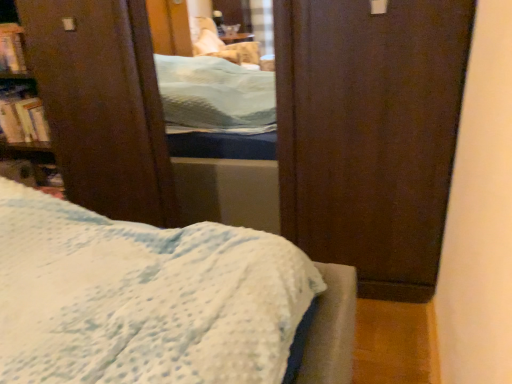
Question: Considering the relative positions of hardcover book at upper left, positioned as the second book in bottom-to-top order, and hardcover book at left, marked as the 1th book in a bottom-to-top arrangement, in the image provided, is hardcover book at upper left, positioned as the second book in bottom-to-top order, to the right of hardcover book at left, marked as the 1th book in a bottom-to-top arrangement, from the viewer's perspective?

Choices:
 (A) yes
 (B) no

Answer: (B)

Question: Is hardcover book at upper left, positioned as the second book in bottom-to-top order, to the left of hardcover book at left, marked as the 1th book in a bottom-to-top arrangement, from the viewer's perspective?

Choices:
 (A) yes
 (B) no

Answer: (A)

Question: Is hardcover book at upper left, placed as the 1th book when sorted from top to bottom, taller than hardcover book at left, which is the 2th book from top to bottom?

Choices:
 (A) no
 (B) yes

Answer: (B)

Question: Is hardcover book at upper left, placed as the 1th book when sorted from top to bottom, wider than hardcover book at left, which is the 2th book from top to bottom?

Choices:
 (A) no
 (B) yes

Answer: (A)

Question: Does hardcover book at upper left, placed as the 1th book when sorted from top to bottom, have a lesser height compared to hardcover book at left, marked as the 1th book in a bottom-to-top arrangement?

Choices:
 (A) no
 (B) yes

Answer: (A)

Question: Is hardcover book at upper left, placed as the 1th book when sorted from top to bottom, facing away from hardcover book at left, which is the 2th book from top to bottom?

Choices:
 (A) yes
 (B) no

Answer: (B)

Question: Is hardcover book at left, marked as the 1th book in a bottom-to-top arrangement, to the left of hardcover book at upper left, positioned as the second book in bottom-to-top order, from the viewer's perspective?

Choices:
 (A) yes
 (B) no

Answer: (B)

Question: Can you confirm if hardcover book at left, which is the 2th book from top to bottom, is smaller than hardcover book at upper left, placed as the 1th book when sorted from top to bottom?

Choices:
 (A) yes
 (B) no

Answer: (A)

Question: Can you confirm if hardcover book at left, marked as the 1th book in a bottom-to-top arrangement, is bigger than hardcover book at upper left, positioned as the second book in bottom-to-top order?

Choices:
 (A) yes
 (B) no

Answer: (B)

Question: Can you confirm if hardcover book at left, which is the 2th book from top to bottom, is wider than hardcover book at upper left, placed as the 1th book when sorted from top to bottom?

Choices:
 (A) yes
 (B) no

Answer: (A)

Question: Does hardcover book at left, which is the 2th book from top to bottom, have a lesser width compared to hardcover book at upper left, placed as the 1th book when sorted from top to bottom?

Choices:
 (A) no
 (B) yes

Answer: (A)

Question: Is hardcover book at left, marked as the 1th book in a bottom-to-top arrangement, looking in the opposite direction of hardcover book at upper left, placed as the 1th book when sorted from top to bottom?

Choices:
 (A) no
 (B) yes

Answer: (A)

Question: Relative to hardcover book at upper left, placed as the 1th book when sorted from top to bottom, is hardcover book at left, which is the 2th book from top to bottom, in front or behind?

Choices:
 (A) behind
 (B) front

Answer: (A)